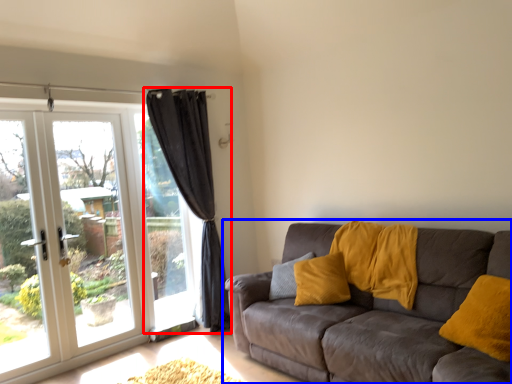
Question: Which object is closer to the camera taking this photo, curtain (highlighted by a red box) or studio couch (highlighted by a blue box)?

Choices:
 (A) curtain
 (B) studio couch

Answer: (B)